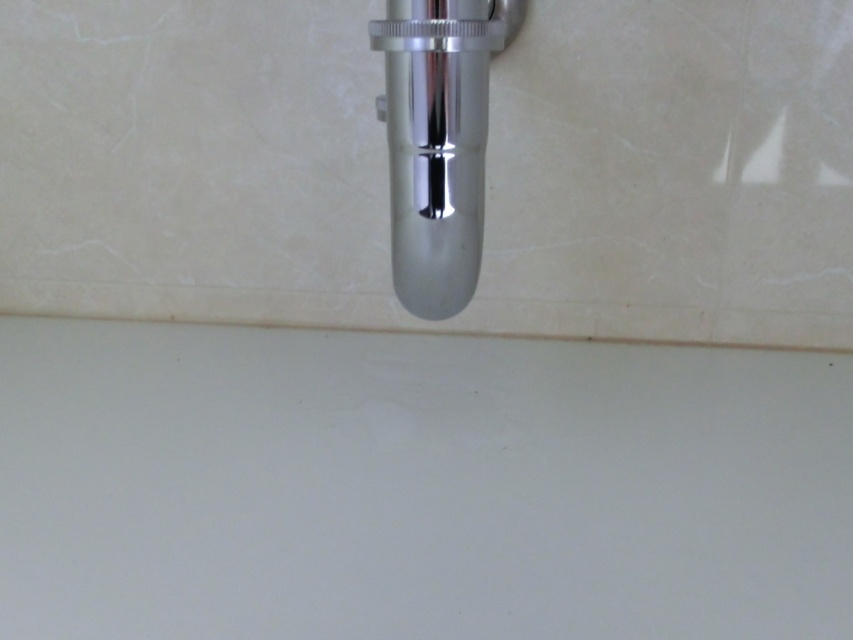
Which is behind, point (175, 369) or point (431, 269)?

The point (175, 369) is more distant.

This screenshot has height=640, width=853. Describe the element at coordinates (416, 486) in the screenshot. I see `white matte sink at bottom` at that location.

Where is `white matte sink at bottom`? white matte sink at bottom is located at coordinates (416, 486).